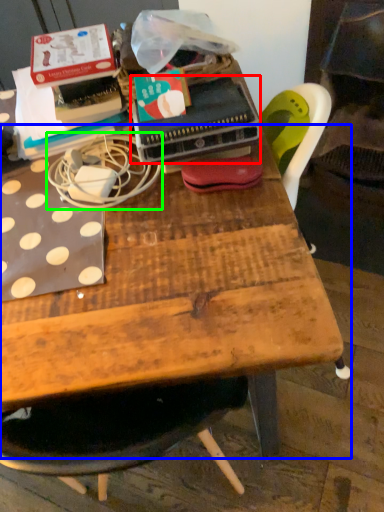
Question: Which object is positioned closest to paperback book (highlighted by a red box)? Select from table (highlighted by a blue box) and string (highlighted by a green box).

Choices:
 (A) table
 (B) string

Answer: (B)